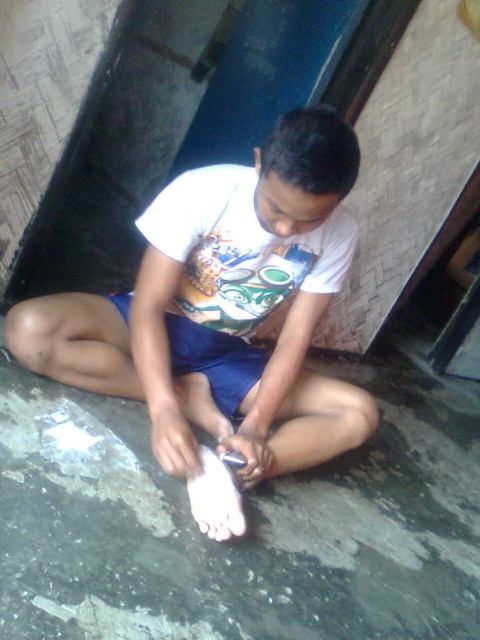
Is shiny gray cement at lower center below white matte shirt at center?

Correct, shiny gray cement at lower center is located below white matte shirt at center.

Does point (8, 413) lie behind point (46, 372)?

No, it is not.

Is point (56, 403) farther from viewer compared to point (47, 316)?

Yes.

The height and width of the screenshot is (640, 480). Identify the location of shiny gray cement at lower center. 249,525.